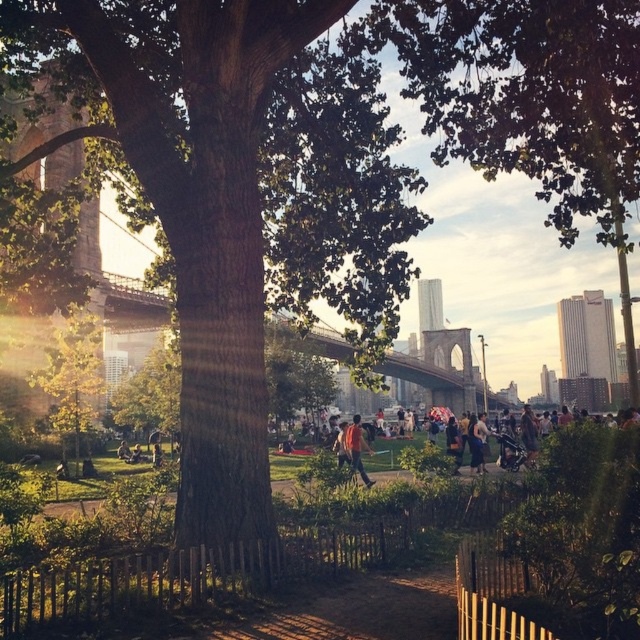
Question: Which of the following is the closest to the observer?

Choices:
 (A) (152, 348)
 (B) (353, 445)
 (C) (246, 563)
 (D) (92, 417)

Answer: (C)

Question: Which of these objects is positioned closest to the orange fabric jacket at center?

Choices:
 (A) yellow-green leaves at center
 (B) green grass at center
 (C) denim shorts at center
 (D) green leafy tree at center

Answer: (C)

Question: Can you confirm if green grass at center is thinner than yellow-green leaves at center?

Choices:
 (A) no
 (B) yes

Answer: (B)

Question: Observing the image, what is the correct spatial positioning of green leafy tree at center in reference to orange fabric jacket at center?

Choices:
 (A) below
 (B) above

Answer: (B)

Question: Estimate the real-world distances between objects in this image. Which object is closer to the yellow-green leaves at center?

Choices:
 (A) orange fabric jacket at center
 (B) denim shorts at center

Answer: (A)

Question: Is orange fabric jacket at center wider than denim shorts at center?

Choices:
 (A) no
 (B) yes

Answer: (A)